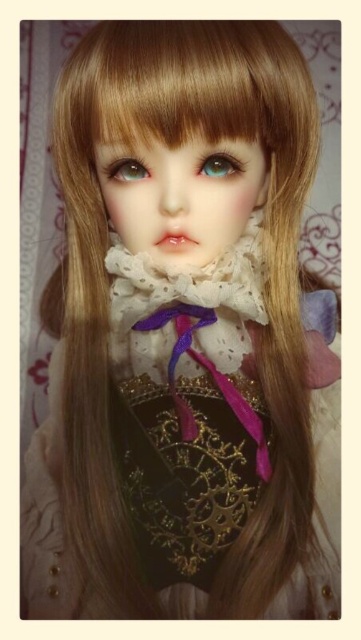
Is point (233, 157) more distant than point (131, 180)?

No, it is not.

Find the location of a particular element. teal glossy eye at center is located at coordinates (219, 164).

Image resolution: width=361 pixels, height=640 pixels. In order to click on teal glossy eye at center in this screenshot , I will do `click(219, 164)`.